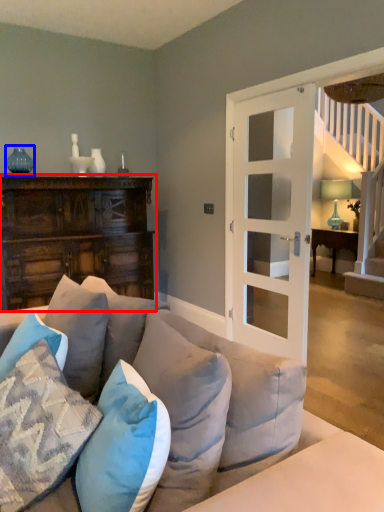
Question: Which object appears closest to the camera in this image, cabinetry (highlighted by a red box) or teal (highlighted by a blue box)?

Choices:
 (A) cabinetry
 (B) teal

Answer: (A)